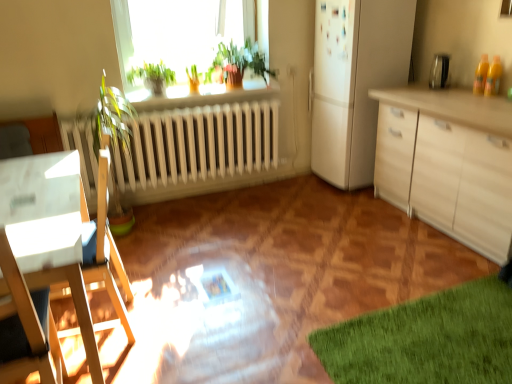
How much space does green matte plant at upper center, which is the second plant in right-to-left order, occupy horizontally?

green matte plant at upper center, which is the second plant in right-to-left order, is 10.28 inches in width.

Where is `green leafy plant at upper center`? Image resolution: width=512 pixels, height=384 pixels. green leafy plant at upper center is located at coordinates (239, 63).

Based on the photo, is white matte refrigerator at upper right facing away from green leafy plant at upper center, which is the first plant from right to left?

No, white matte refrigerator at upper right's orientation is not away from green leafy plant at upper center, which is the first plant from right to left.

Is green leafy plant at upper center, which is the second plant in left-to-right order, a part of white matte refrigerator at upper right?

Actually, green leafy plant at upper center, which is the second plant in left-to-right order, is outside white matte refrigerator at upper right.

Is point (334, 34) behind point (192, 92)?

No, (334, 34) is closer to viewer.

From the image's perspective, is white matte refrigerator at upper right below green leafy plant at upper center, which is the first plant from right to left?

Actually, white matte refrigerator at upper right appears above green leafy plant at upper center, which is the first plant from right to left, in the image.

Is green leafy plant at upper center, which is the second plant in left-to-right order, bigger than white matte refrigerator at upper right?

No.

Is green leafy plant at upper center, which is the first plant from right to left, not near white matte refrigerator at upper right?

Yes, green leafy plant at upper center, which is the first plant from right to left, is far from white matte refrigerator at upper right.

From a real-world perspective, who is located higher, green leafy plant at upper center, which is the second plant in left-to-right order, or white matte refrigerator at upper right?

white matte refrigerator at upper right.

What's the angular difference between green leafy plant at upper center, which is the first plant from right to left, and white matte refrigerator at upper right's facing directions?

green leafy plant at upper center, which is the first plant from right to left, and white matte refrigerator at upper right are facing 87.4 degrees away from each other.

The height and width of the screenshot is (384, 512). Identify the location of houseplant above the white wood desk at left (from the image's perspective). (239, 63).

From a real-world perspective, who is located lower, white wood desk at left or green leafy plant at upper center?

white wood desk at left, from a real-world perspective.

Would you consider white wood desk at left to be distant from green leafy plant at upper center?

white wood desk at left is far away from green leafy plant at upper center.

Choose the correct answer: Is white wood desk at left inside green leafy plant at upper center or outside it?

white wood desk at left lies outside green leafy plant at upper center.

This screenshot has height=384, width=512. I want to click on desk in front of the green leafy plant at upper center, so pyautogui.click(x=49, y=230).

Is green leafy plant at upper center not within white wood desk at left?

That's correct, green leafy plant at upper center is outside of white wood desk at left.

Looking at the image, does green leafy plant at upper center seem bigger or smaller compared to white wood desk at left?

Considering their sizes, green leafy plant at upper center takes up less space than white wood desk at left.

Is green leafy plant at upper center in contact with white wood desk at left?

green leafy plant at upper center and white wood desk at left are not in contact.

Looking at this image, is white matte refrigerator at upper right aimed at green leafy plant at upper center?

Yes.

How much distance is there between white matte refrigerator at upper right and green leafy plant at upper center?

A distance of 24.38 inches exists between white matte refrigerator at upper right and green leafy plant at upper center.

Does white matte refrigerator at upper right have a smaller size compared to green leafy plant at upper center?

Yes.

From the image's perspective, between white matte refrigerator at upper right and green leafy plant at upper center, who is located below?

green leafy plant at upper center is shown below in the image.

Does white matte refrigerator at upper right appear on the right side of green matte plant at upper center, the first plant when ordered from left to right?

Correct, you'll find white matte refrigerator at upper right to the right of green matte plant at upper center, the first plant when ordered from left to right.

Is white matte refrigerator at upper right further to the viewer compared to green matte plant at upper center, which is the second plant in right-to-left order?

No, white matte refrigerator at upper right is in front of green matte plant at upper center, which is the second plant in right-to-left order.

Measure the distance between white matte refrigerator at upper right and green matte plant at upper center, which is the second plant in right-to-left order.

They are 1.30 meters apart.

In the scene shown: Is white matte refrigerator at upper right positioned with its back to green matte plant at upper center, which is the second plant in right-to-left order?

That's not correct — white matte refrigerator at upper right is not looking away from green matte plant at upper center, which is the second plant in right-to-left order.

Is green leafy plant at upper center, which is the first plant from right to left, looking in the opposite direction of white wood desk at left?

No, white wood desk at left is not at the back of green leafy plant at upper center, which is the first plant from right to left.

Can you confirm if green leafy plant at upper center, which is the second plant in left-to-right order, is shorter than white wood desk at left?

Yes.

Considering the sizes of objects green leafy plant at upper center, which is the second plant in left-to-right order, and white wood desk at left in the image provided, who is bigger, green leafy plant at upper center, which is the second plant in left-to-right order, or white wood desk at left?

white wood desk at left.

Would you consider green leafy plant at upper center, which is the first plant from right to left, to be distant from white wood desk at left?

That's right, there is a large distance between green leafy plant at upper center, which is the first plant from right to left, and white wood desk at left.

The width and height of the screenshot is (512, 384). I want to click on the 2nd plant below the white matte refrigerator at upper right (from a real-world perspective), so click(193, 79).

At what (x,y) coordinates should I click in order to perform the action: click on screen door that is in front of the green leafy plant at upper center, which is the first plant from right to left. Please return your answer as a coordinate pair (x, y). The image size is (512, 384). Looking at the image, I should click on (334, 49).

Based on their spatial positions, is green leafy plant at upper center, which is the second plant in left-to-right order, or green leafy plant at upper center closer to white matte refrigerator at upper right?

green leafy plant at upper center lies closer to white matte refrigerator at upper right than the other object.

Based on their spatial positions, is green matte plant at upper center, the first plant when ordered from left to right, or white wood desk at left further from white matte refrigerator at upper right?

white wood desk at left is further to white matte refrigerator at upper right.

Estimate the real-world distances between objects in this image. Which object is closer to green matte plant at upper center, the first plant when ordered from left to right, white matte refrigerator at upper right or green leafy plant at upper center, which is the first plant from right to left?

Based on the image, green leafy plant at upper center, which is the first plant from right to left, appears to be nearer to green matte plant at upper center, the first plant when ordered from left to right.

When comparing their distances from white matte refrigerator at upper right, does white wood desk at left or green matte plant at upper center, the first plant when ordered from left to right, seem closer?

green matte plant at upper center, the first plant when ordered from left to right, lies closer to white matte refrigerator at upper right than the other object.

Based on their spatial positions, is white wood desk at left or green matte plant at upper center, the first plant when ordered from left to right, further from green leafy plant at upper center?

Among the two, white wood desk at left is located further to green leafy plant at upper center.

Based on their spatial positions, is white wood desk at left or green leafy plant at upper center further from white matte refrigerator at upper right?

white wood desk at left lies further to white matte refrigerator at upper right than the other object.

Looking at the image, which one is located closer to green leafy plant at upper center, green leafy plant at upper center, which is the second plant in left-to-right order, or white wood desk at left?

Based on the image, green leafy plant at upper center, which is the second plant in left-to-right order, appears to be nearer to green leafy plant at upper center.

Looking at the image, which one is located closer to green leafy plant at upper center, which is the first plant from right to left, green leafy plant at upper center or white wood desk at left?

green leafy plant at upper center is positioned closer to the anchor green leafy plant at upper center, which is the first plant from right to left.

You are a GUI agent. You are given a task and a screenshot of the screen. Output one action in this format:
    pyautogui.click(x=<x>, y=<y>)
    Task: Click on the houseplant positioned between white wood desk at left and green leafy plant at upper center, which is the first plant from right to left, from near to far
    Image resolution: width=512 pixels, height=384 pixels.
    Given the screenshot: What is the action you would take?
    pyautogui.click(x=239, y=63)

I want to click on screen door positioned between white wood desk at left and green leafy plant at upper center from near to far, so click(x=334, y=49).

Identify the location of screen door positioned between white wood desk at left and green matte plant at upper center, which is the second plant in right-to-left order, from near to far. The image size is (512, 384). (334, 49).

Locate an element on the screen. Image resolution: width=512 pixels, height=384 pixels. plant located between white wood desk at left and green leafy plant at upper center, which is the first plant from right to left, in the depth direction is located at coordinates (153, 76).